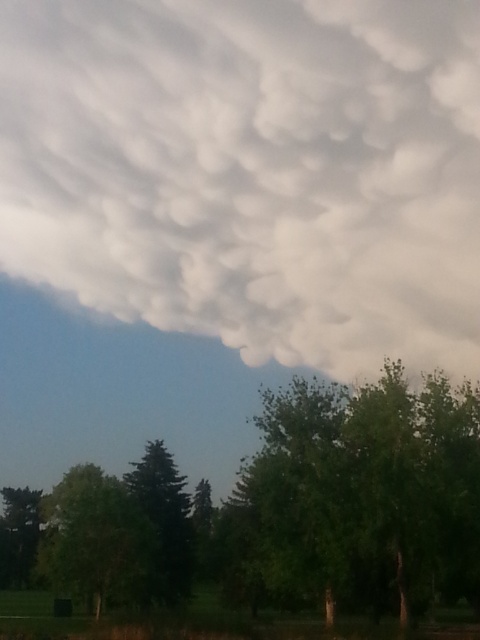
You are standing in the outdoor scene and want to take a photo focusing on the green matte tree at center. However, you notice another green matte tree at lower left in your viewfinder. What is the relationship between their positions in the image?

The green matte tree at center is positioned over the green matte tree at lower left, so the tree at center appears in front of the one at lower left in the image.

You are standing in the middle of a forest and want to find the tallest tree between the green matte tree at center and the green matte tree at lower left. Which tree should you look towards?

The green matte tree at lower left is taller than the green matte tree at center, so you should look towards the green matte tree at lower left.

Based on the photo, you are an astronomer observing the sky through a telescope. You notice the white fluffy cloud at upper center and the green matte tree at center in your view. Which object is closer to your telescope lens?

The white fluffy cloud at upper center is closer to the telescope lens because it is in front of the green matte tree at center.